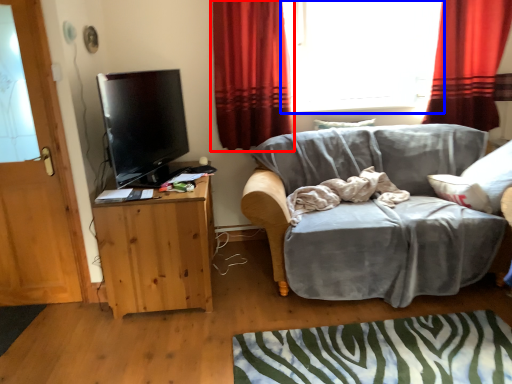
Question: Which object is further to the camera taking this photo, curtain (highlighted by a red box) or window (highlighted by a blue box)?

Choices:
 (A) curtain
 (B) window

Answer: (B)